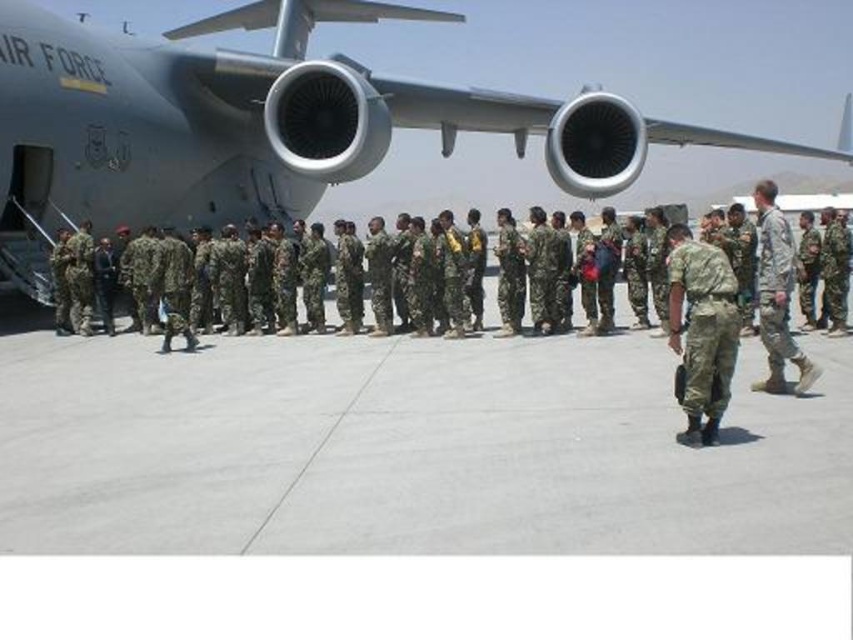
Between camouflage uniform at center and camouflage fabric uniform at right, which one is positioned higher?

Positioned higher is camouflage uniform at center.

Who is positioned more to the right, camouflage uniform at center or camouflage fabric uniform at right?

Positioned to the right is camouflage uniform at center.

Locate an element on the screen. Image resolution: width=853 pixels, height=640 pixels. camouflage uniform at center is located at coordinates (701, 326).

Between metallic gray airplane at upper center and camouflage fabric uniform at right, which one is positioned higher?

Positioned higher is metallic gray airplane at upper center.

Which is below, metallic gray airplane at upper center or camouflage fabric uniform at right?

camouflage fabric uniform at right is below.

The image size is (853, 640). I want to click on metallic gray airplane at upper center, so coord(259,124).

Is camouflage fabric pants at center positioned at the back of camouflage fabric uniform at right?

No, it is in front of camouflage fabric uniform at right.

Which is behind, point (723, 378) or point (780, 259)?

The point (780, 259) is behind.

This screenshot has height=640, width=853. Find the location of `camouflage fabric pants at center`. camouflage fabric pants at center is located at coordinates (703, 323).